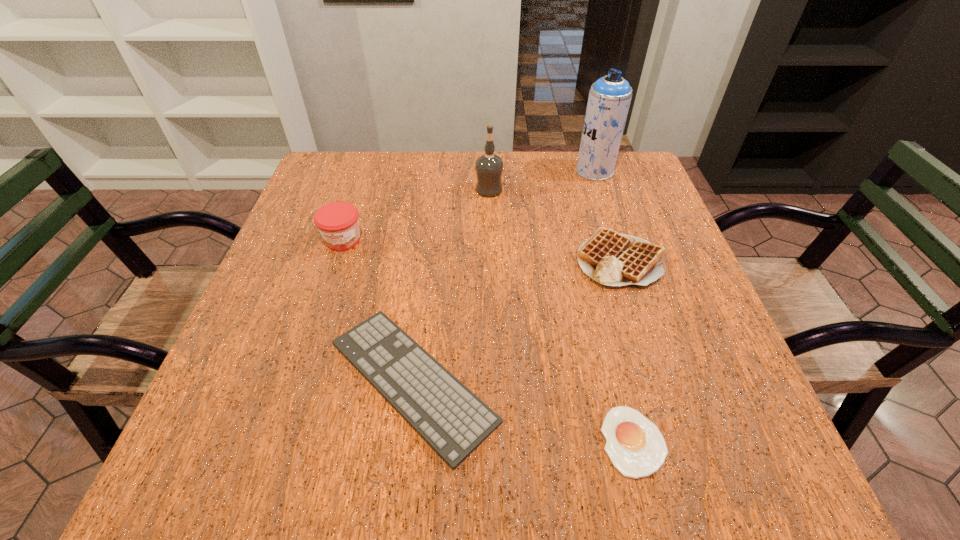
At what (x,y) coordinates should I click in order to perform the action: click on free space located on the front label of the vodka. Please return your answer as a coordinate pair (x, y). Looking at the image, I should click on (410, 190).

Where is `vacant space positioned 0.110m on the front label of the vodka`? vacant space positioned 0.110m on the front label of the vodka is located at coordinates (433, 190).

Locate an element on the screen. This screenshot has width=960, height=540. free space located on the label side of the jam is located at coordinates (307, 352).

Locate an element on the screen. The width and height of the screenshot is (960, 540). vacant space located on the left of the waffle is located at coordinates (539, 259).

Where is `vacant point located on the back of the computer keyboard`? This screenshot has height=540, width=960. vacant point located on the back of the computer keyboard is located at coordinates (433, 208).

This screenshot has width=960, height=540. In order to click on vacant space located 0.210m on the left of the shortest object in this screenshot , I will do `click(468, 441)`.

Locate an element on the screen. The width and height of the screenshot is (960, 540). aerosol can located at the far edge is located at coordinates (609, 99).

This screenshot has width=960, height=540. What are the coordinates of `vodka that is at the far edge` in the screenshot? It's located at (489, 167).

Image resolution: width=960 pixels, height=540 pixels. In order to click on computer keyboard that is at the near edge in this screenshot , I will do `click(445, 413)`.

Locate an element on the screen. Image resolution: width=960 pixels, height=540 pixels. egg yolk present at the near edge is located at coordinates (x=636, y=447).